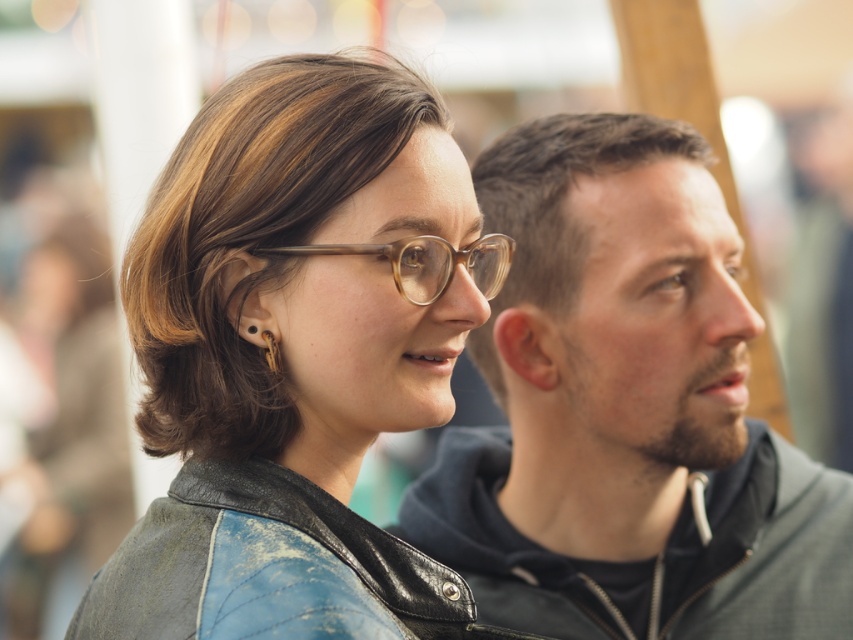
You are a photographer trying to capture a candid shot of the two people in the scene. You notice the matte gray hoodie at center and the translucent amber eyeglasses at center. Which object is positioned lower in the image?

The matte gray hoodie at center is positioned below the translucent amber eyeglasses at center, so the matte gray hoodie at center is lower in the image.

You are trying to decide which jacket to take for a casual outing. Both the leather jacket at upper left and the matte gray hoodie at center are options. Based on their thickness, which one would be more suitable if you want a lighter layer?

The leather jacket at upper left is thinner than the matte gray hoodie at center, so it would be more suitable for a lighter layer.